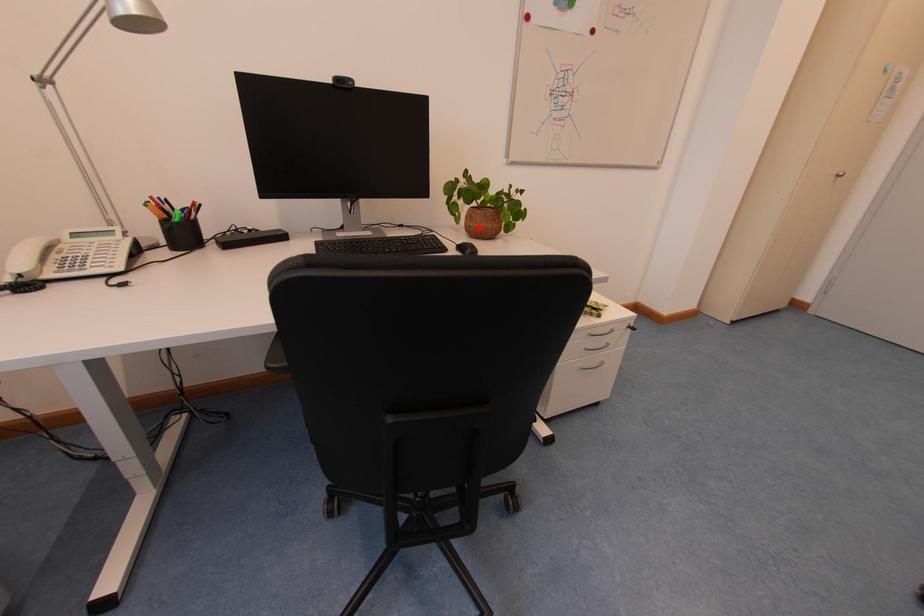
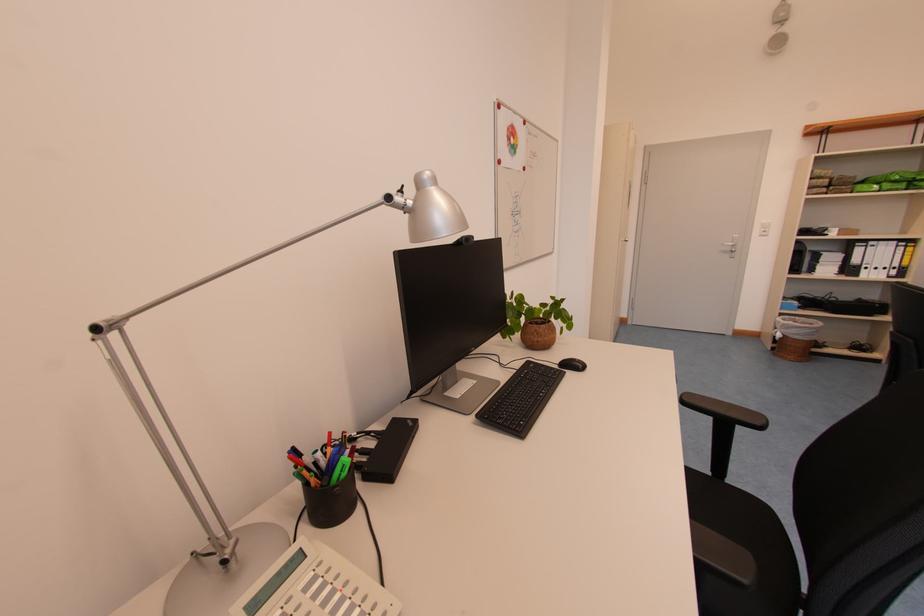
Question: I am providing you with two images of the same scene from different viewpoints. In image1, a red point is highlighted. Considering the same 3D point in image2, which of the following is correct?

Choices:
 (A) It is closer
 (B) It is farther

Answer: (B)